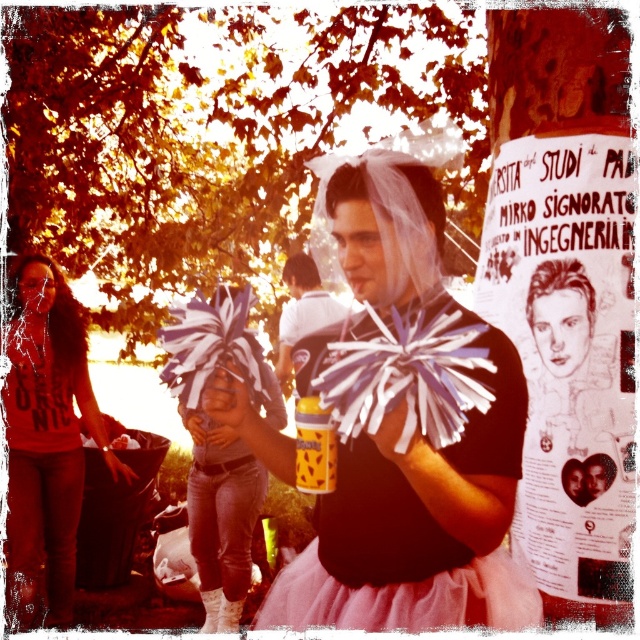
In the scene shown: What is located at the point with coordinates (202, 134) in the image?

At point (202, 134), there are golden leaves at upper left.

You are a photographer who wants to capture a photo of the white paper poster at center and golden leaves at upper left in the same frame. The camera can only focus on objects within 3 meters of each other. Will both objects be in focus?

The golden leaves at upper left is 3.65 meters from white paper poster at center, so the camera cannot focus on both objects since they are more than 3 meters apart.